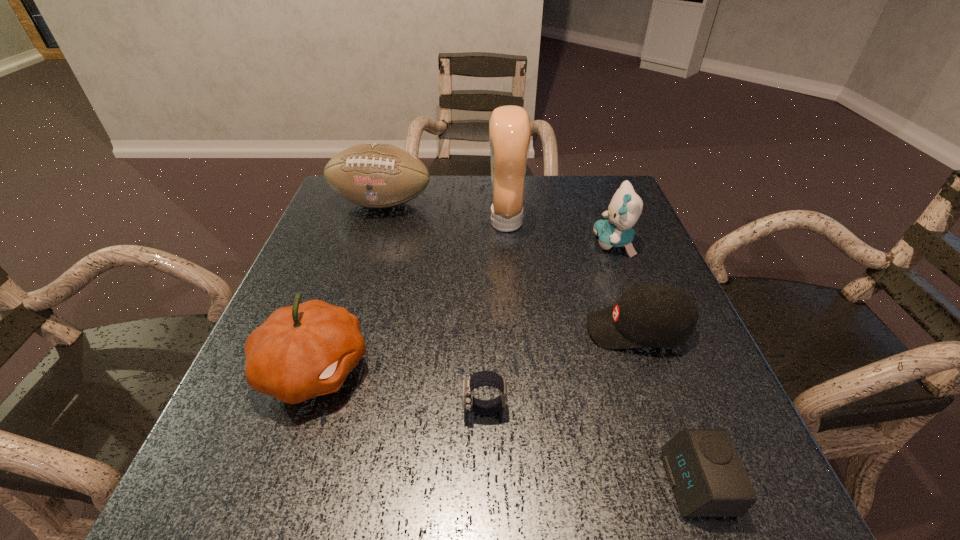
The width and height of the screenshot is (960, 540). In order to click on object that stands as the fourth closest to the pumpkin in this screenshot , I will do `click(651, 314)`.

Find the location of `object identified as the fifth closest to the football (American)`. object identified as the fifth closest to the football (American) is located at coordinates (482, 378).